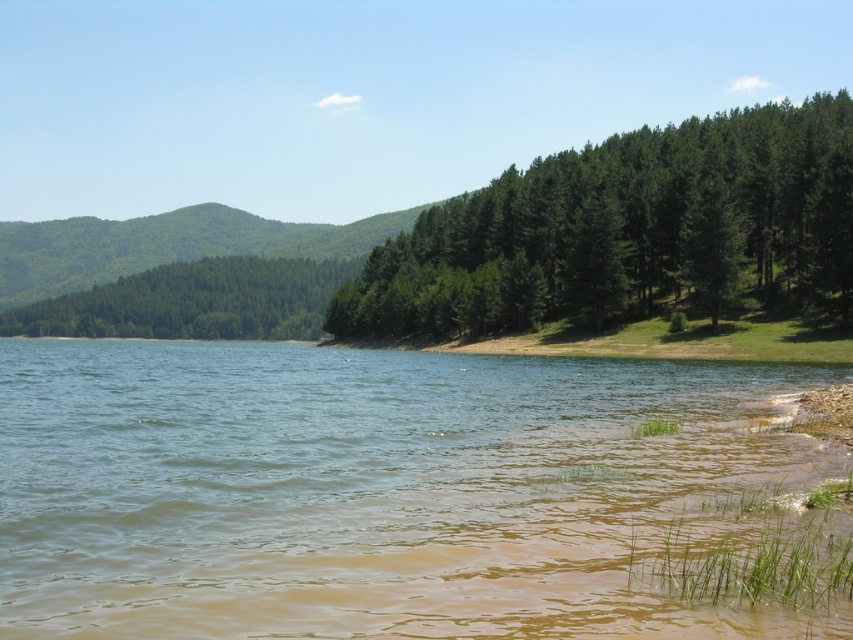
Question: Based on their relative distances, which object is farther from the green leafy trees at right?

Choices:
 (A) green leafy trees at left
 (B) brown muddy water at lower center

Answer: (A)

Question: Does brown muddy water at lower center lie behind green leafy trees at left?

Choices:
 (A) no
 (B) yes

Answer: (A)

Question: Which point is closer to the camera taking this photo?

Choices:
 (A) (187, 332)
 (B) (315, 586)
 (C) (604, 232)

Answer: (B)

Question: Which of the following is the closest to the observer?

Choices:
 (A) (196, 273)
 (B) (544, 278)

Answer: (B)

Question: Is green leafy trees at right to the right of green leafy trees at left from the viewer's perspective?

Choices:
 (A) no
 (B) yes

Answer: (B)

Question: Is green leafy trees at right to the left of green leafy trees at left from the viewer's perspective?

Choices:
 (A) no
 (B) yes

Answer: (A)